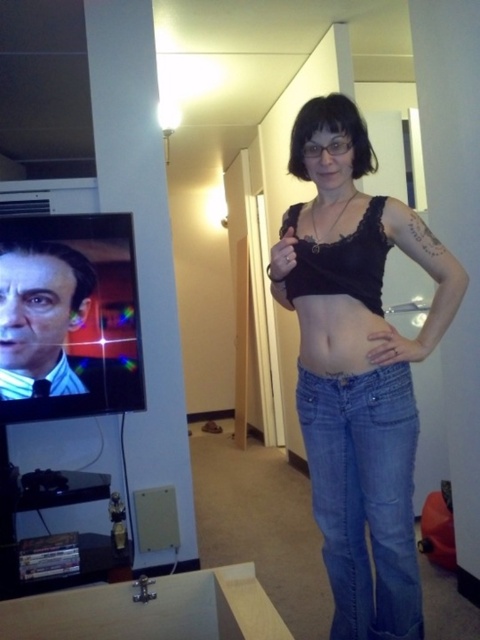
Question: Considering the relative positions of black lace top at center and black lace bikini top at center in the image provided, where is black lace top at center located with respect to black lace bikini top at center?

Choices:
 (A) below
 (B) above

Answer: (A)

Question: Does black lace top at center have a lesser width compared to matte black skin at center?

Choices:
 (A) no
 (B) yes

Answer: (A)

Question: Which point is farther to the camera?

Choices:
 (A) matte black skin at center
 (B) black lace bikini top at center
 (C) denim jeans at center

Answer: (C)

Question: Based on their relative distances, which object is nearer to the matte black skin at center?

Choices:
 (A) black lace top at center
 (B) black lace bikini top at center
 (C) striped fabric tie at left
 (D) denim jeans at center

Answer: (B)

Question: Is denim jeans at center to the right of matte black skin at center from the viewer's perspective?

Choices:
 (A) yes
 (B) no

Answer: (A)

Question: Which point appears closest to the camera in this image?

Choices:
 (A) (336, 454)
 (B) (376, 234)
 (C) (375, 384)
 (D) (11, 369)

Answer: (B)